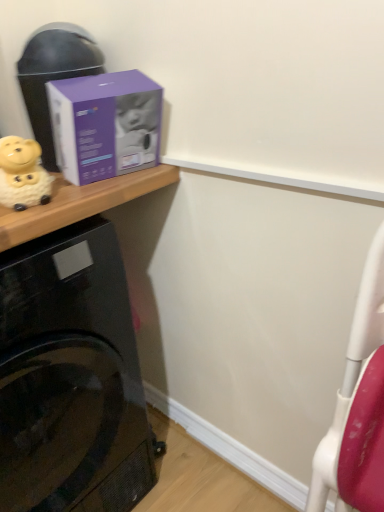
What do you see at coordinates (105, 125) in the screenshot? The width and height of the screenshot is (384, 512). I see `purple matte box at upper left` at bounding box center [105, 125].

Identify the location of black glossy washing machine at lower left. (70, 377).

The image size is (384, 512). Find the location of `purple matte box at upper left`. purple matte box at upper left is located at coordinates (105, 125).

Identify the location of box above the black glossy washing machine at lower left (from the image's perspective). The width and height of the screenshot is (384, 512). (x=105, y=125).

Is point (24, 312) in front of point (79, 89)?

No, (24, 312) is further to viewer.

Does black glossy washing machine at lower left appear on the right side of purple matte box at upper left?

In fact, black glossy washing machine at lower left is to the left of purple matte box at upper left.

Based on the photo, are black glossy washing machine at lower left and purple matte box at upper left making contact?

No, black glossy washing machine at lower left is not next to purple matte box at upper left.

From the image's perspective, between purple cardboard box at upper left and black glossy washing machine at lower left, who is located below?

black glossy washing machine at lower left.

Is purple cardboard box at upper left positioned before black glossy washing machine at lower left?

No, purple cardboard box at upper left is behind black glossy washing machine at lower left.

How far apart are purple cardboard box at upper left and black glossy washing machine at lower left?

18.83 inches.

Considering the relative sizes of purple cardboard box at upper left and black glossy washing machine at lower left in the image provided, is purple cardboard box at upper left shorter than black glossy washing machine at lower left?

Indeed, purple cardboard box at upper left has a lesser height compared to black glossy washing machine at lower left.

Find the location of a particular element. The width and height of the screenshot is (384, 512). toy below the purple cardboard box at upper left (from a real-world perspective) is located at coordinates click(x=23, y=174).

Between point (49, 56) and point (24, 207), which one is positioned in front?

Positioned in front is point (24, 207).

Could you tell me if purple cardboard box at upper left is facing yellow matte piggy bank at left?

No, purple cardboard box at upper left is not oriented towards yellow matte piggy bank at left.

Between purple cardboard box at upper left and yellow matte piggy bank at left, which one appears on the right side from the viewer's perspective?

purple cardboard box at upper left is more to the right.

Which is in front, yellow matte piggy bank at left or purple matte box at upper left?

yellow matte piggy bank at left is more forward.

Which is correct: yellow matte piggy bank at left is inside purple matte box at upper left, or outside of it?

yellow matte piggy bank at left exists outside the volume of purple matte box at upper left.

Between yellow matte piggy bank at left and purple matte box at upper left, which one appears on the right side from the viewer's perspective?

purple matte box at upper left is more to the right.

From the picture: Between black glossy washing machine at lower left and purple cardboard box at upper left, which one has smaller size?

purple cardboard box at upper left.

Is black glossy washing machine at lower left directly adjacent to purple cardboard box at upper left?

No, black glossy washing machine at lower left is not touching purple cardboard box at upper left.

From a real-world perspective, does black glossy washing machine at lower left sit lower than purple cardboard box at upper left?

Yes, from a real-world perspective, black glossy washing machine at lower left is below purple cardboard box at upper left.

Considering the positions of point (90, 342) and point (41, 45), is point (90, 342) closer or farther from the camera than point (41, 45)?

Point (90, 342).

Can you tell me how much purple cardboard box at upper left and purple matte box at upper left differ in facing direction?

The facing directions of purple cardboard box at upper left and purple matte box at upper left are 17.3 degrees apart.

Which of these two, purple cardboard box at upper left or purple matte box at upper left, stands taller?

purple cardboard box at upper left is taller.

From the image's perspective, is purple cardboard box at upper left below purple matte box at upper left?

No.

Would you consider purple cardboard box at upper left to be distant from purple matte box at upper left?

No, there isn't a large distance between purple cardboard box at upper left and purple matte box at upper left.

Is yellow matte piggy bank at left beside purple cardboard box at upper left?

No, yellow matte piggy bank at left is not with purple cardboard box at upper left.

Who is smaller, yellow matte piggy bank at left or purple cardboard box at upper left?

yellow matte piggy bank at left is smaller.

At what (x,y) coordinates should I click in order to perform the action: click on appliance behind the yellow matte piggy bank at left. Please return your answer as a coordinate pair (x, y). This screenshot has width=384, height=512. Looking at the image, I should click on (54, 74).

Which point is more forward, [13,193] or [57,64]?

The point [13,193] is more forward.

Locate an element on the screen. The height and width of the screenshot is (512, 384). box that is behind the black glossy washing machine at lower left is located at coordinates (105, 125).

Locate an element on the screen. appliance on the right side of black glossy washing machine at lower left is located at coordinates (54, 74).

Considering their positions, is yellow matte piggy bank at left positioned closer to black glossy washing machine at lower left than purple cardboard box at upper left?

yellow matte piggy bank at left is positioned closer to the anchor black glossy washing machine at lower left.

Looking at the image, which one is located closer to yellow matte piggy bank at left, black glossy washing machine at lower left or purple matte box at upper left?

purple matte box at upper left lies closer to yellow matte piggy bank at left than the other object.

Based on their spatial positions, is black glossy washing machine at lower left or yellow matte piggy bank at left closer to purple cardboard box at upper left?

yellow matte piggy bank at left is positioned closer to the anchor purple cardboard box at upper left.

Which object lies further to the anchor point purple matte box at upper left, black glossy washing machine at lower left or purple cardboard box at upper left?

black glossy washing machine at lower left is positioned further to the anchor purple matte box at upper left.

Based on their spatial positions, is yellow matte piggy bank at left or purple cardboard box at upper left further from purple matte box at upper left?

The object further to purple matte box at upper left is yellow matte piggy bank at left.

Considering their positions, is black glossy washing machine at lower left positioned closer to yellow matte piggy bank at left than purple cardboard box at upper left?

The object closer to yellow matte piggy bank at left is purple cardboard box at upper left.

From the picture: Considering their positions, is purple cardboard box at upper left positioned further to black glossy washing machine at lower left than yellow matte piggy bank at left?

The object further to black glossy washing machine at lower left is purple cardboard box at upper left.

Which object lies nearer to the anchor point black glossy washing machine at lower left, yellow matte piggy bank at left or purple matte box at upper left?

purple matte box at upper left is positioned closer to the anchor black glossy washing machine at lower left.

Where is `box that lies between purple cardboard box at upper left and black glossy washing machine at lower left from top to bottom`? box that lies between purple cardboard box at upper left and black glossy washing machine at lower left from top to bottom is located at coordinates (105, 125).

This screenshot has width=384, height=512. In order to click on box between purple cardboard box at upper left and yellow matte piggy bank at left in the vertical direction in this screenshot , I will do `click(105, 125)`.

This screenshot has height=512, width=384. I want to click on toy between purple cardboard box at upper left and black glossy washing machine at lower left in the vertical direction, so (x=23, y=174).

You are a GUI agent. You are given a task and a screenshot of the screen. Output one action in this format:
    pyautogui.click(x=<x>, y=<y>)
    Task: Click on the toy between purple matte box at upper left and black glossy washing machine at lower left vertically
    The width and height of the screenshot is (384, 512).
    Given the screenshot: What is the action you would take?
    pyautogui.click(x=23, y=174)